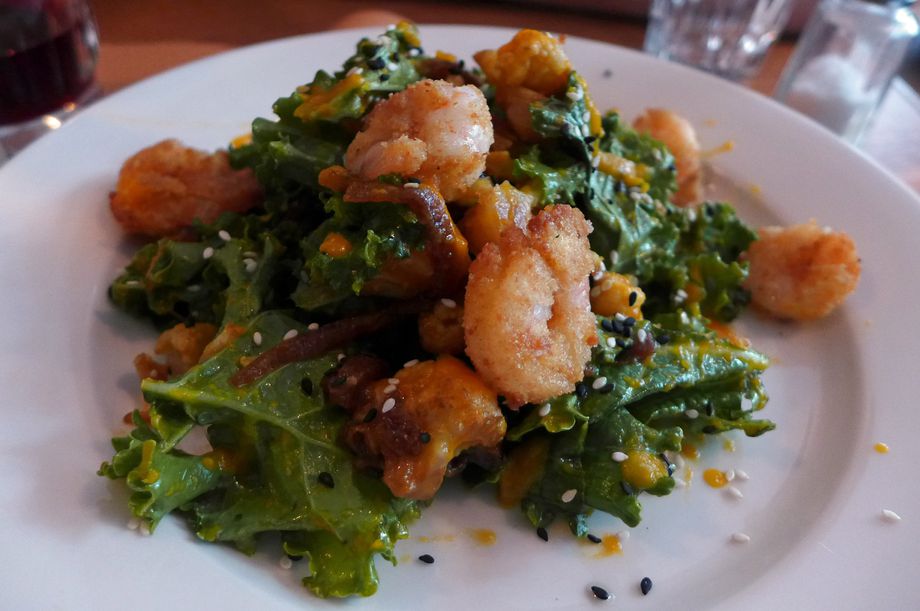
Locate an element on the screen. drop of sauce on white plate is located at coordinates (483, 535), (431, 536), (453, 533), (604, 547), (688, 452), (708, 480), (880, 448), (711, 122), (722, 145).